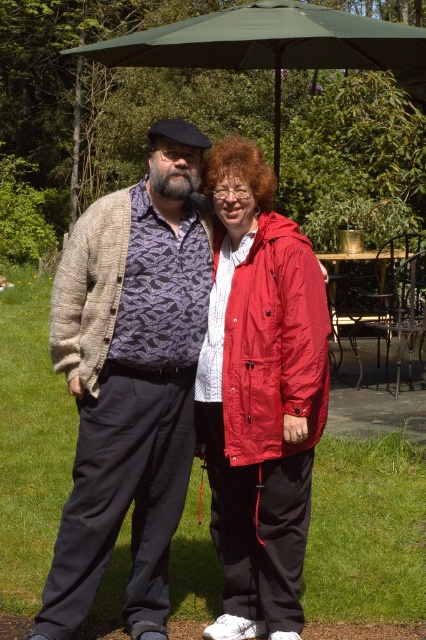
You are standing in the garden and see the two people. There is a point at coordinates (259, 396). Which person is this point on?

The point at coordinates (259, 396) is on the matte red jacket at center, which belongs to the person on the right.